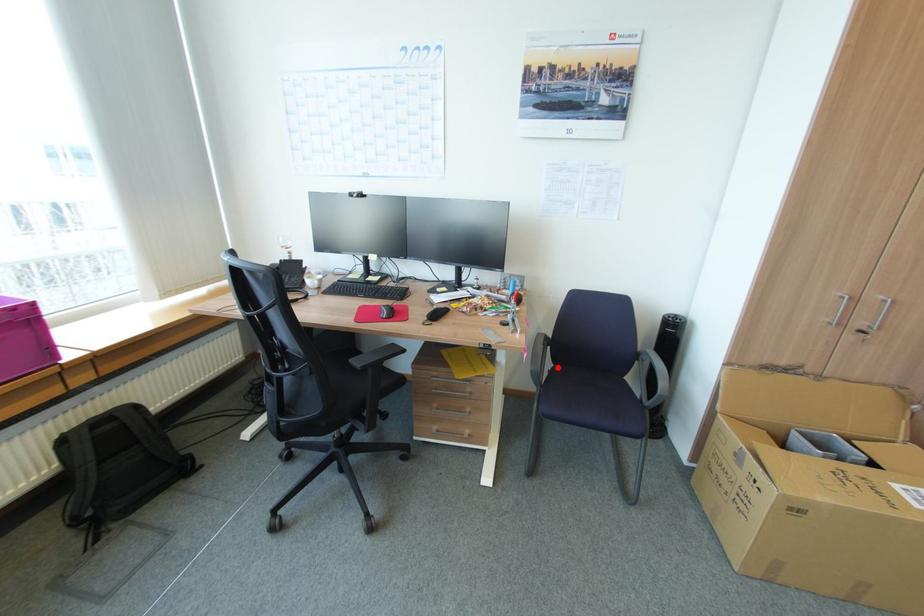
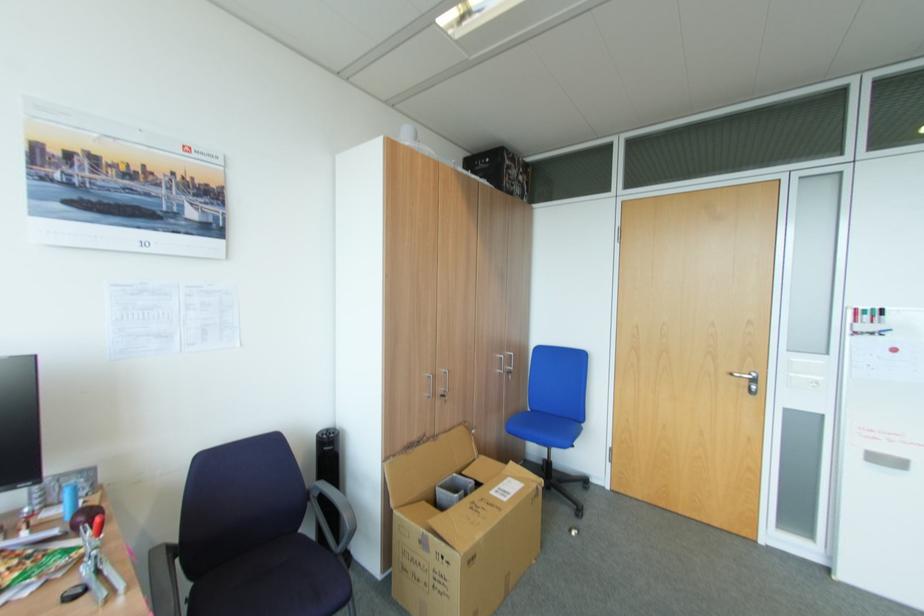
Question: I am providing you with two images of the same scene from different viewpoints. Image1 has a red point marked. In image2, the corresponding 3D location appears at what relative position? Reply with the corresponding letter.

Choices:
 (A) Closer
 (B) Farther

Answer: (B)